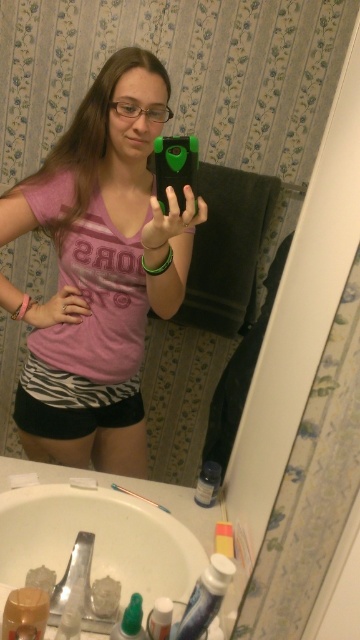
Question: Which object appears closest to the camera in this image?

Choices:
 (A) green matte phone at center
 (B) white ceramic sink at lower left
 (C) zebra print shorts at lower center
 (D) pink matte shirt at center

Answer: (B)

Question: Does zebra print shorts at lower center lie in front of green matte phone at center?

Choices:
 (A) yes
 (B) no

Answer: (B)

Question: Which object is the closest to the zebra print shorts at lower center?

Choices:
 (A) pink matte shirt at center
 (B) green matte phone at center

Answer: (A)

Question: Which point is closer to the camera?

Choices:
 (A) (119, 177)
 (B) (96, 388)

Answer: (A)

Question: Is zebra print shorts at lower center wider than green matte phone at center?

Choices:
 (A) yes
 (B) no

Answer: (A)

Question: Can you confirm if pink matte shirt at center is positioned to the left of green matte phone at center?

Choices:
 (A) yes
 (B) no

Answer: (A)